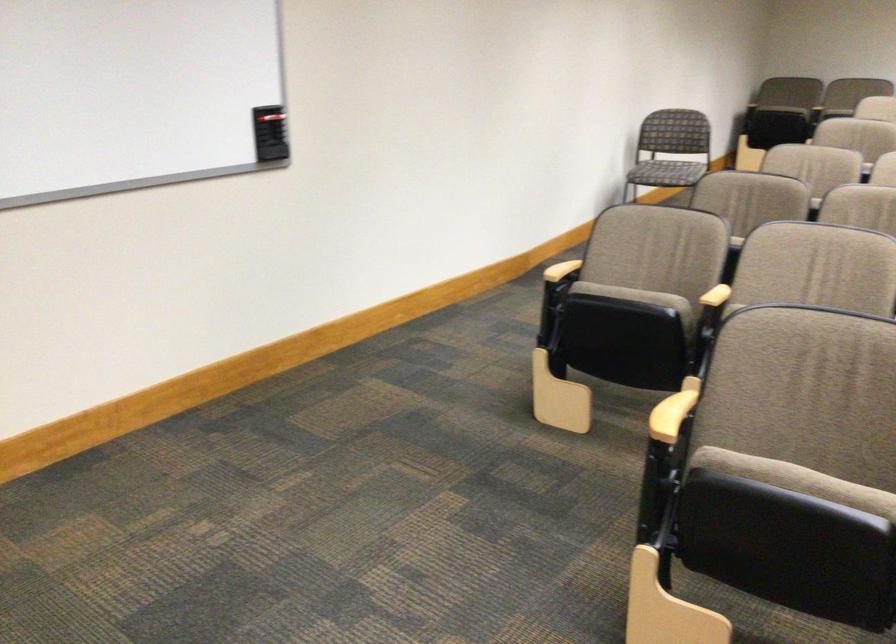
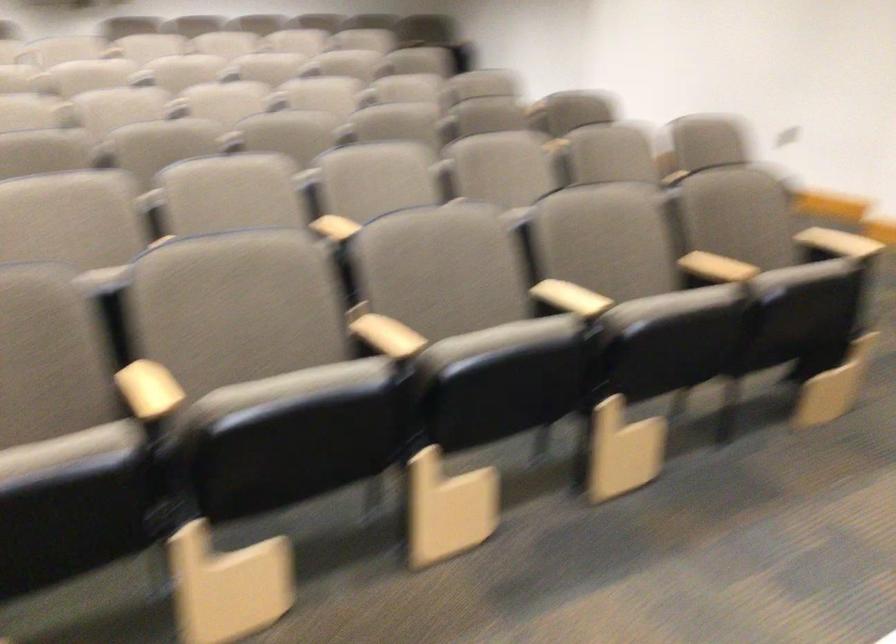
Question: The first image is from the beginning of the video and the second image is from the end. How did the camera likely rotate when shooting the video?

Choices:
 (A) Left
 (B) Right
 (C) Up
 (D) Down

Answer: (B)